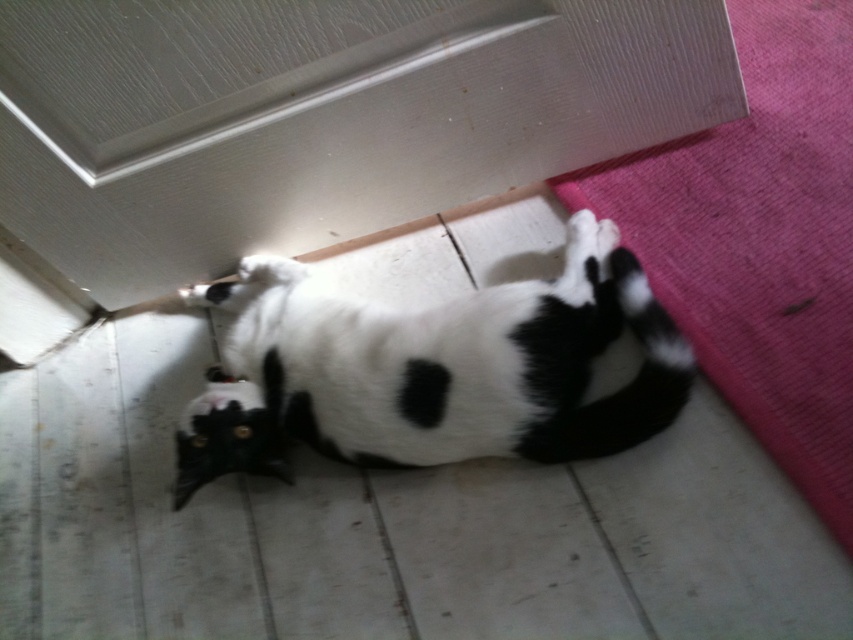
Question: Is black and white fur cat at center thinner than pink fabric mat at lower right?

Choices:
 (A) yes
 (B) no

Answer: (B)

Question: Which point is farther to the camera?

Choices:
 (A) (677, 365)
 (B) (708, 168)

Answer: (B)

Question: Does black and white fur cat at center have a lesser width compared to pink fabric mat at lower right?

Choices:
 (A) no
 (B) yes

Answer: (A)

Question: Which point appears farthest from the camera in this image?

Choices:
 (A) (549, 285)
 (B) (715, 156)

Answer: (B)

Question: Considering the relative positions of black and white fur cat at center and pink fabric mat at lower right in the image provided, where is black and white fur cat at center located with respect to pink fabric mat at lower right?

Choices:
 (A) right
 (B) left

Answer: (B)